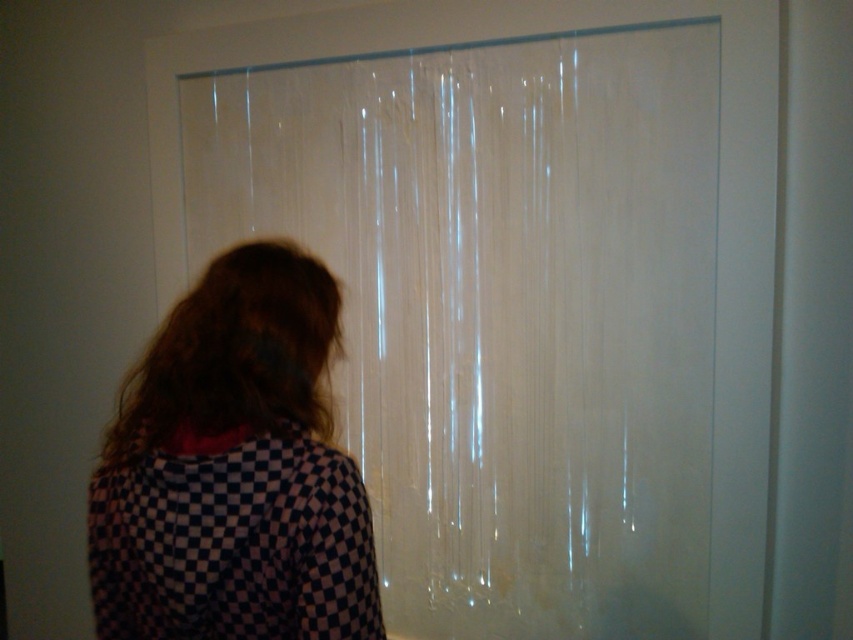
Who is taller, transparent plastic shower curtain at center or brownhair at left?

transparent plastic shower curtain at center

Locate an element on the screen. This screenshot has height=640, width=853. transparent plastic shower curtain at center is located at coordinates click(x=502, y=310).

Can you confirm if transparent plastic shower curtain at center is thinner than checkered fabric at left?

Incorrect, transparent plastic shower curtain at center's width is not less than checkered fabric at left's.

Is transparent plastic shower curtain at center taller than checkered fabric at left?

Yes.

Locate an element on the screen. This screenshot has width=853, height=640. transparent plastic shower curtain at center is located at coordinates (502, 310).

Locate an element on the screen. transparent plastic shower curtain at center is located at coordinates (502, 310).

From the picture: Can you confirm if checkered fabric at left is bigger than brownhair at left?

Yes.

Does checkered fabric at left have a lesser width compared to brownhair at left?

No, checkered fabric at left is not thinner than brownhair at left.

Find the location of a particular element. checkered fabric at left is located at coordinates (233, 470).